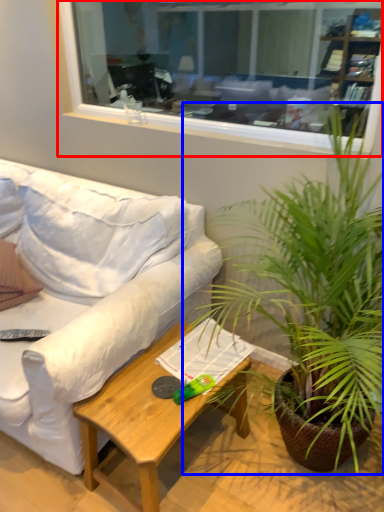
Question: Which of the following is the closest to the observer, window (highlighted by a red box) or houseplant (highlighted by a blue box)?

Choices:
 (A) window
 (B) houseplant

Answer: (B)